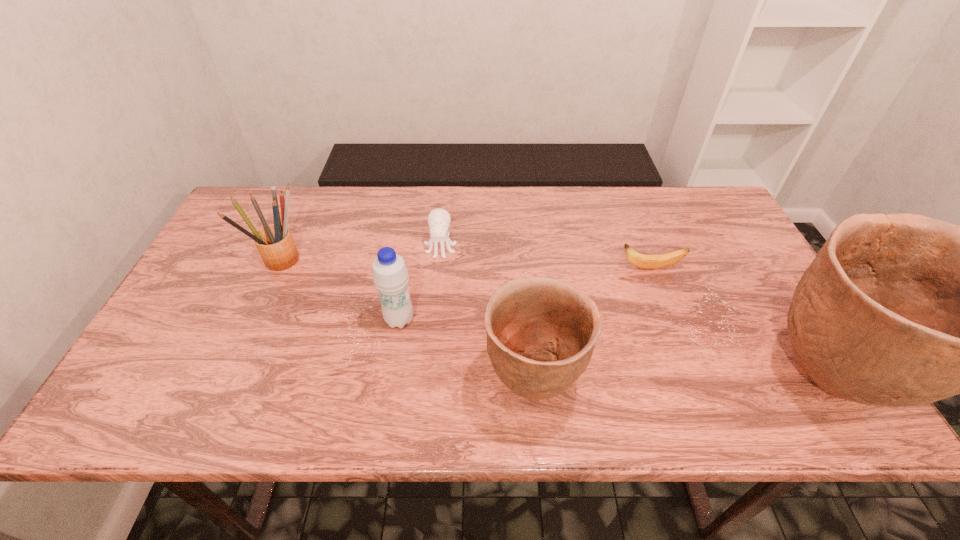
Image resolution: width=960 pixels, height=540 pixels. In the image, there is a desktop. Identify the location of blank space at the far edge. (353, 209).

Identify the location of vacant space at the left edge. The width and height of the screenshot is (960, 540). (241, 303).

In the image, there is a desktop. Identify the location of blank space at the right edge. (759, 337).

You are a GUI agent. You are given a task and a screenshot of the screen. Output one action in this format:
    pyautogui.click(x=<x>, y=<y>)
    Task: Click on the vacant area at the far left corner of the desktop
    The image size is (960, 540).
    Given the screenshot: What is the action you would take?
    pyautogui.click(x=250, y=210)

At what (x,y) coordinates should I click in order to perform the action: click on blank region between the water bottle and the taller pottery. Please return your answer as a coordinate pair (x, y). The height and width of the screenshot is (540, 960). Looking at the image, I should click on (614, 349).

Locate an element on the screen. The height and width of the screenshot is (540, 960). free spot between the fifth object from left to right and the second shortest object is located at coordinates (545, 258).

The width and height of the screenshot is (960, 540). I want to click on vacant space in between the pencil box and the octopus, so click(363, 254).

The image size is (960, 540). Find the location of `free space between the water bottle and the third object from right to left`. free space between the water bottle and the third object from right to left is located at coordinates (466, 350).

Image resolution: width=960 pixels, height=540 pixels. Find the location of `free space between the rightmost object and the left pottery`. free space between the rightmost object and the left pottery is located at coordinates (681, 380).

Find the location of a particular element. This screenshot has width=960, height=540. free area in between the water bottle and the right pottery is located at coordinates [614, 349].